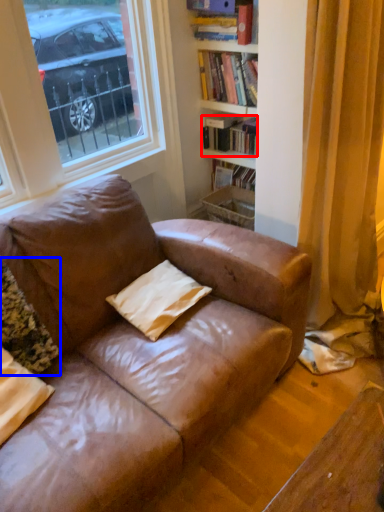
Question: Which point is further to the camera, book (highlighted by a red box) or pillow (highlighted by a blue box)?

Choices:
 (A) book
 (B) pillow

Answer: (A)